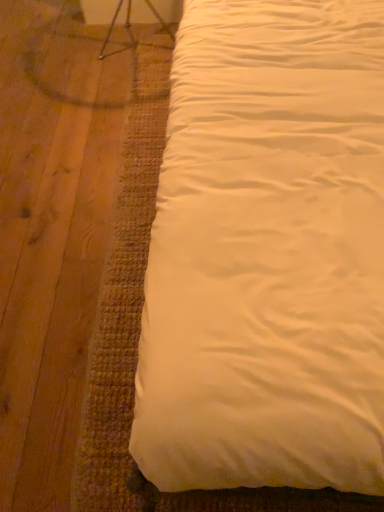
Question: Does white satin bed at upper right lie in front of metallic silver swivel chair at upper left?

Choices:
 (A) yes
 (B) no

Answer: (A)

Question: Considering the relative sizes of white satin bed at upper right and metallic silver swivel chair at upper left in the image provided, is white satin bed at upper right thinner than metallic silver swivel chair at upper left?

Choices:
 (A) yes
 (B) no

Answer: (B)

Question: Is white satin bed at upper right not near metallic silver swivel chair at upper left?

Choices:
 (A) yes
 (B) no

Answer: (A)

Question: Does white satin bed at upper right have a larger size compared to metallic silver swivel chair at upper left?

Choices:
 (A) yes
 (B) no

Answer: (A)

Question: From the image's perspective, is white satin bed at upper right beneath metallic silver swivel chair at upper left?

Choices:
 (A) no
 (B) yes

Answer: (B)

Question: Is white satin bed at upper right at the right side of metallic silver swivel chair at upper left?

Choices:
 (A) no
 (B) yes

Answer: (B)

Question: Is metallic silver swivel chair at upper left facing towards white satin bed at upper right?

Choices:
 (A) no
 (B) yes

Answer: (A)

Question: Is metallic silver swivel chair at upper left thinner than white satin bed at upper right?

Choices:
 (A) yes
 (B) no

Answer: (A)

Question: From a real-world perspective, is metallic silver swivel chair at upper left over white satin bed at upper right?

Choices:
 (A) yes
 (B) no

Answer: (B)

Question: From the image's perspective, is metallic silver swivel chair at upper left located above white satin bed at upper right?

Choices:
 (A) no
 (B) yes

Answer: (B)

Question: Is metallic silver swivel chair at upper left far from white satin bed at upper right?

Choices:
 (A) no
 (B) yes

Answer: (B)

Question: Is metallic silver swivel chair at upper left wider than white satin bed at upper right?

Choices:
 (A) yes
 (B) no

Answer: (B)

Question: In the image, is white satin bed at upper right on the left side or the right side of metallic silver swivel chair at upper left?

Choices:
 (A) right
 (B) left

Answer: (A)